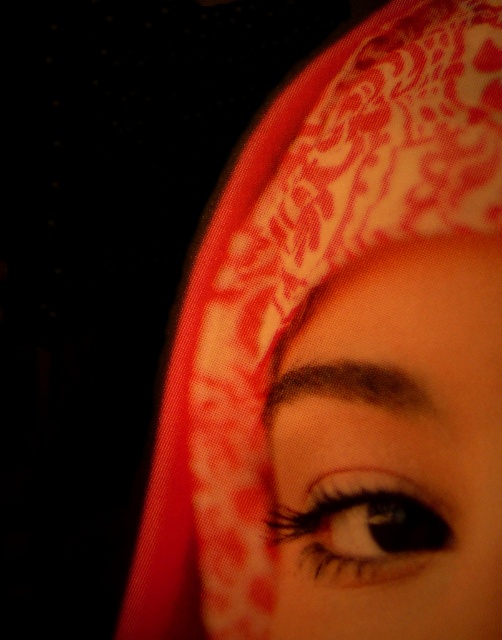
Which is below, matte red headscarf at upper center or dark brown eyebrow at upper center?

Positioned lower is matte red headscarf at upper center.

Is point (368, 458) closer to viewer compared to point (361, 397)?

Yes.

At what (x,y) coordinates should I click in order to perform the action: click on matte red headscarf at upper center. Please return your answer as a coordinate pair (x, y). Looking at the image, I should click on (392, 449).

Where is `black glossy eye at center`? black glossy eye at center is located at coordinates (363, 529).

Is point (411, 566) positioned in front of point (406, 378)?

Yes, it is.

Between point (357, 552) and point (277, 394), which one is positioned in front?

Point (357, 552)

The image size is (502, 640). I want to click on black glossy eye at center, so click(x=363, y=529).

Is matte red headscarf at upper center shorter than black glossy eye at center?

Incorrect, matte red headscarf at upper center's height does not fall short of black glossy eye at center's.

From the picture: Does matte red headscarf at upper center have a greater width compared to black glossy eye at center?

Correct, the width of matte red headscarf at upper center exceeds that of black glossy eye at center.

Between point (335, 456) and point (386, 540), which one is positioned behind?

The point (335, 456) is more distant.

Locate an element on the screen. This screenshot has width=502, height=640. matte red headscarf at upper center is located at coordinates (392, 449).